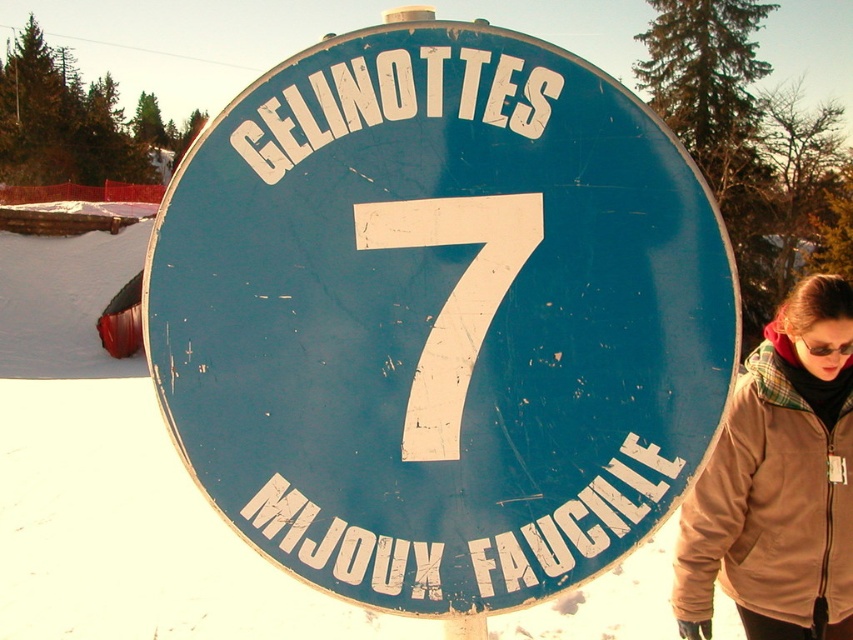
Question: Does brown fleece jacket at lower right have a larger size compared to black plastic goggles at center?

Choices:
 (A) no
 (B) yes

Answer: (B)

Question: Which object appears closest to the camera in this image?

Choices:
 (A) brown fleece jacket at lower right
 (B) black plastic goggles at center
 (C) blue matte sign at center

Answer: (C)

Question: Which object is farther from the camera taking this photo?

Choices:
 (A) brown fleece jacket at lower right
 (B) black plastic goggles at center

Answer: (B)

Question: Can you confirm if blue matte sign at center is positioned to the right of brown fleece jacket at lower right?

Choices:
 (A) yes
 (B) no

Answer: (B)

Question: Among these points, which one is nearest to the camera?

Choices:
 (A) (830, 349)
 (B) (689, 568)
 (C) (352, 598)

Answer: (C)

Question: Can you confirm if brown fleece jacket at lower right is smaller than black plastic goggles at center?

Choices:
 (A) no
 (B) yes

Answer: (A)